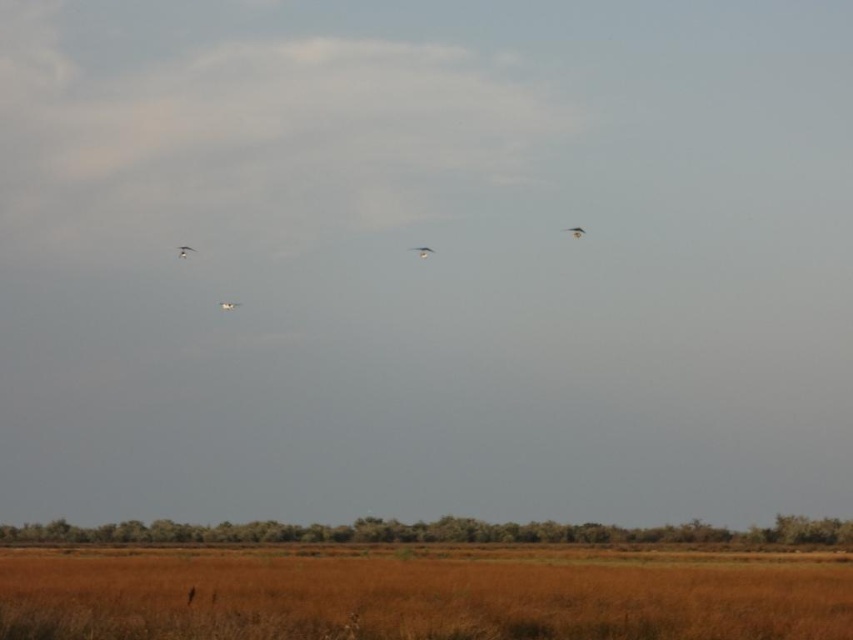
You are a small animal trying to hide from predators in the brown dry grass at lower center. Can you see the smooth feathered bird at upper right from your hiding spot?

The brown dry grass at lower center is taller than the smooth feathered bird at upper right, so yes, the small animal can see the bird from its hiding spot.

You are a photographer standing in the field. You want to capture a photo where the white glossy bird at upper center is clearly visible against the brown dry grass at lower center. Is the current positioning of the bird and grass suitable for this purpose?

Yes, the positioning is suitable because the white glossy bird at upper center is above the brown dry grass at lower center, creating a clear contrast between the two.